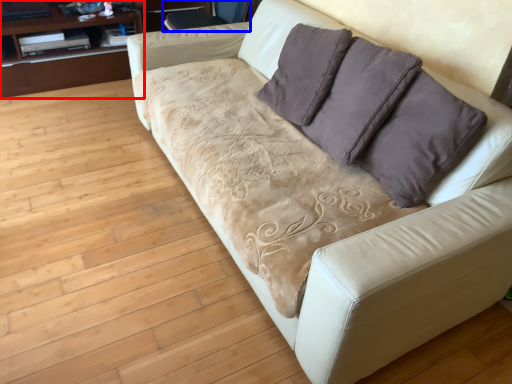
Question: Which point is closer to the camera, dresser (highlighted by a red box) or armchair (highlighted by a blue box)?

Choices:
 (A) dresser
 (B) armchair

Answer: (B)